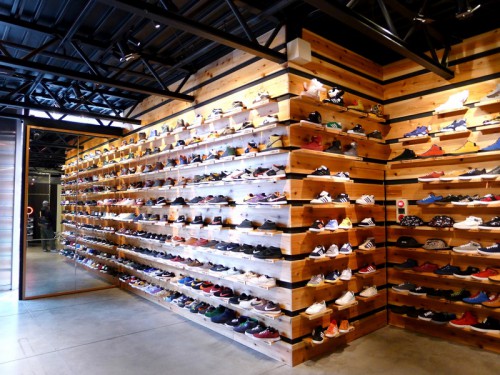
Locate an element on the screen. The image size is (500, 375). visible concrete floor tiles is located at coordinates pos(71,299), pos(4,301), pos(18,333), pos(95,351), pos(48,373), pos(84,310), pos(326,370).